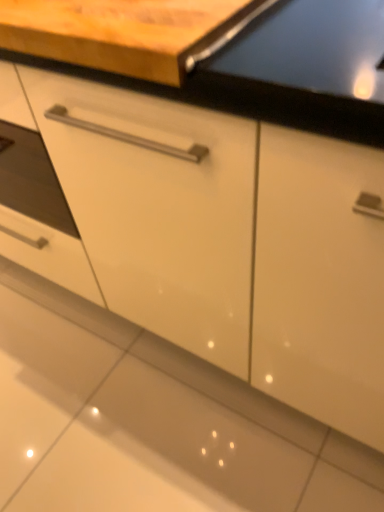
Question: Should I look upward or downward to see wooden cutting board at upper center?

Choices:
 (A) up
 (B) down

Answer: (A)